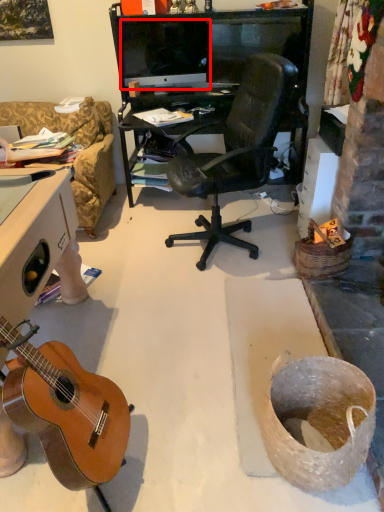
Question: From the image's perspective, considering the relative positions of computer monitor (annotated by the red box) and guitar in the image provided, where is computer monitor (annotated by the red box) located with respect to the staircase?

Choices:
 (A) above
 (B) below

Answer: (A)